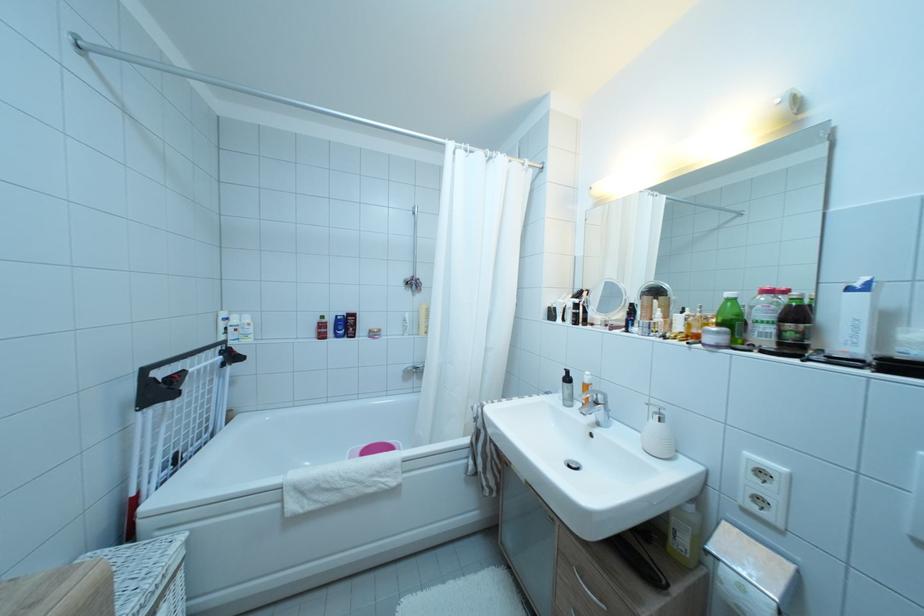
I want to click on metal shower head, so click(417, 215).